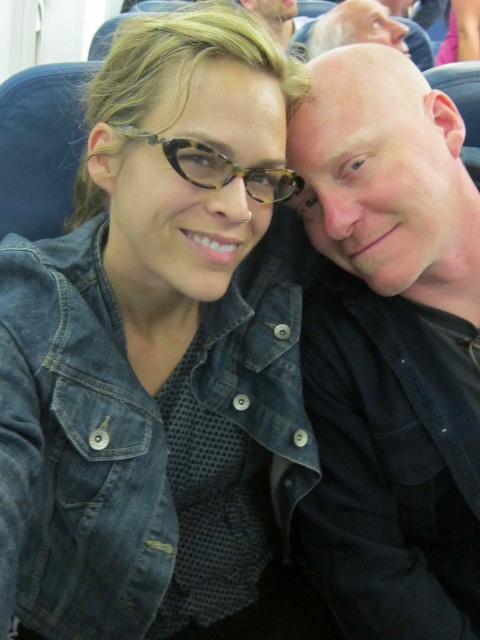
Can you confirm if faded denim jacket at lower right is positioned above black matte shirt at right?

Actually, faded denim jacket at lower right is below black matte shirt at right.

What are the coordinates of `faded denim jacket at lower right` in the screenshot? It's located at (137, 436).

At what (x,y) coordinates should I click in order to perform the action: click on faded denim jacket at lower right. Please return your answer as a coordinate pair (x, y). The width and height of the screenshot is (480, 640). Looking at the image, I should click on (137, 436).

Consider the image. Who is shorter, faded denim jacket at lower right or bald head at upper center?

With less height is bald head at upper center.

The image size is (480, 640). What are the coordinates of `faded denim jacket at lower right` in the screenshot? It's located at (137, 436).

Is faded denim jacket at lower right thinner than tortoiseshell glasses at upper center?

No.

What do you see at coordinates (137, 436) in the screenshot?
I see `faded denim jacket at lower right` at bounding box center [137, 436].

The height and width of the screenshot is (640, 480). In order to click on faded denim jacket at lower right in this screenshot , I will do `click(137, 436)`.